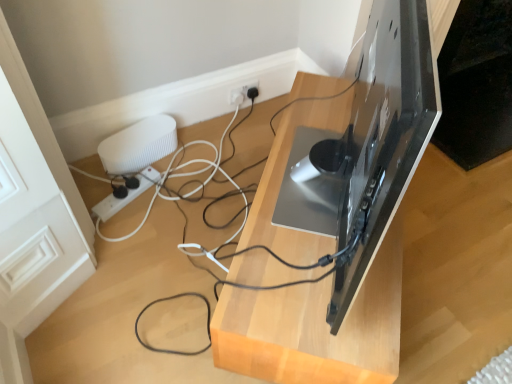
Question: Is white ribbed speaker at left far from matte black tv stand at center?

Choices:
 (A) yes
 (B) no

Answer: (B)

Question: Is white ribbed speaker at left further to camera compared to matte black tv stand at center?

Choices:
 (A) no
 (B) yes

Answer: (B)

Question: From a real-world perspective, is white ribbed speaker at left below matte black tv stand at center?

Choices:
 (A) no
 (B) yes

Answer: (B)

Question: From the image's perspective, is white ribbed speaker at left on matte black tv stand at center?

Choices:
 (A) yes
 (B) no

Answer: (A)

Question: Does white ribbed speaker at left appear on the right side of matte black tv stand at center?

Choices:
 (A) yes
 (B) no

Answer: (B)

Question: In the image, is white ribbed speaker at left on the left side or the right side of white plastic power strip at lower left?

Choices:
 (A) left
 (B) right

Answer: (B)

Question: Would you say white ribbed speaker at left is inside or outside white plastic power strip at lower left?

Choices:
 (A) outside
 (B) inside

Answer: (A)

Question: Considering the positions of point (142, 129) and point (145, 177), is point (142, 129) closer or farther from the camera than point (145, 177)?

Choices:
 (A) closer
 (B) farther

Answer: (B)

Question: From the image's perspective, is white ribbed speaker at left located above or below white plastic power strip at lower left?

Choices:
 (A) below
 (B) above

Answer: (B)

Question: Considering the relative positions of matte black tv stand at center and white ribbed speaker at left in the image provided, is matte black tv stand at center to the left or to the right of white ribbed speaker at left?

Choices:
 (A) right
 (B) left

Answer: (A)

Question: Looking at their shapes, would you say matte black tv stand at center is wider or thinner than white ribbed speaker at left?

Choices:
 (A) thin
 (B) wide

Answer: (B)

Question: Considering the positions of matte black tv stand at center and white ribbed speaker at left in the image, is matte black tv stand at center bigger or smaller than white ribbed speaker at left?

Choices:
 (A) small
 (B) big

Answer: (B)

Question: From the image's perspective, is matte black tv stand at center located above or below white ribbed speaker at left?

Choices:
 (A) below
 (B) above

Answer: (A)

Question: In terms of size, does white ribbed speaker at left appear bigger or smaller than matte black tv stand at center?

Choices:
 (A) small
 (B) big

Answer: (A)

Question: Considering their positions, is white ribbed speaker at left located in front of or behind matte black tv stand at center?

Choices:
 (A) behind
 (B) front

Answer: (A)